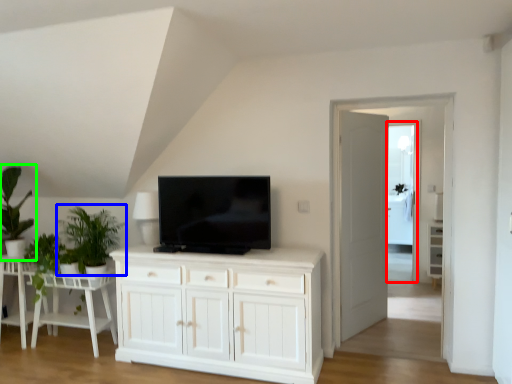
Question: Considering the real-world distances, which object is closest to glass door (highlighted by a red box)? plant (highlighted by a blue box) or houseplant (highlighted by a green box).

Choices:
 (A) plant
 (B) houseplant

Answer: (A)